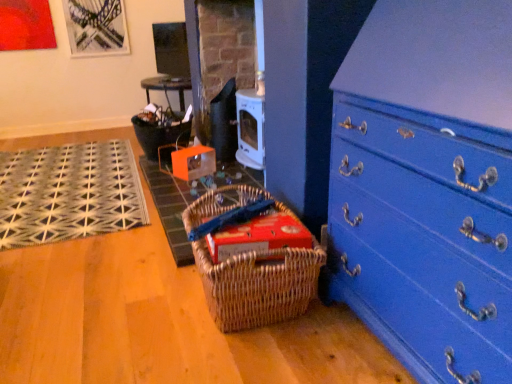
The image size is (512, 384). Identify the location of free point to the left of woven brown picnic basket at lower center. (131, 294).